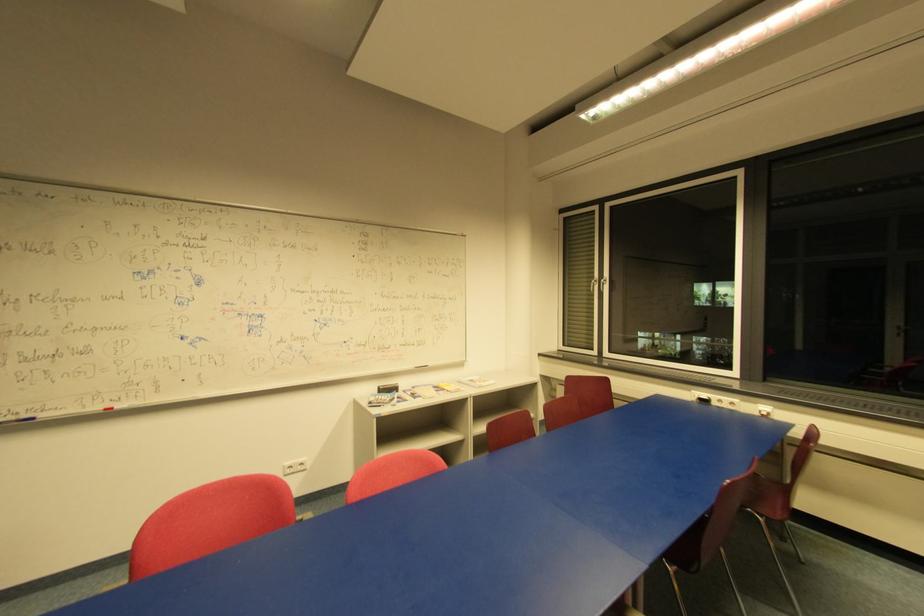
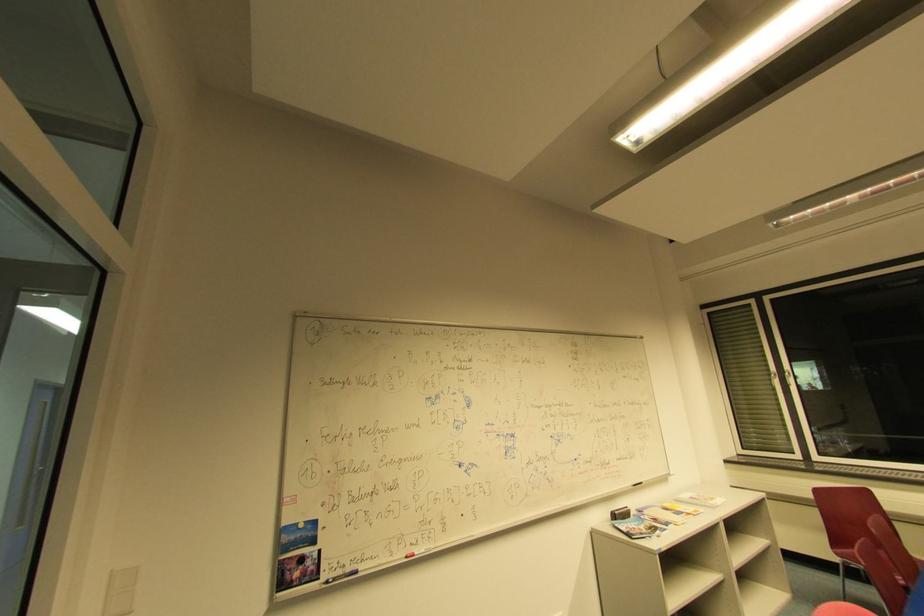
Where in the second image is the point corresponding to (x=608, y=282) from the first image?

(791, 375)